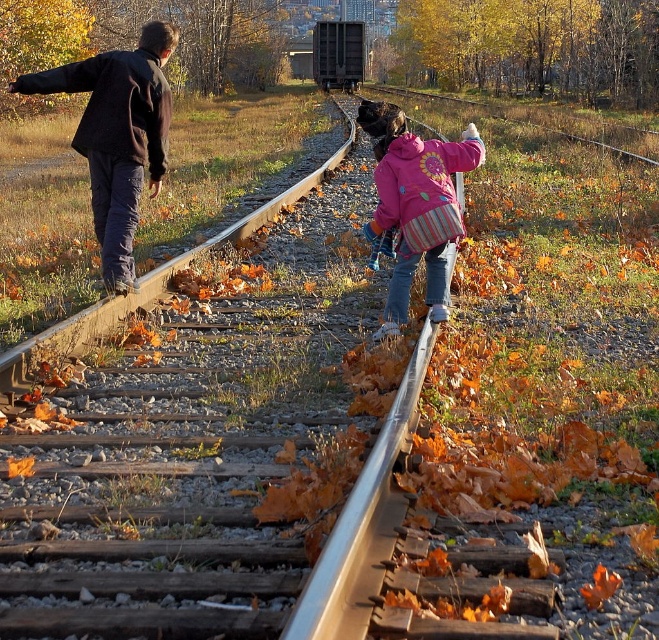
Which is below, dark brown jacket at left or pink fleece jacket at center?

Positioned lower is pink fleece jacket at center.

Who is taller, dark brown jacket at left or pink fleece jacket at center?

Standing taller between the two is dark brown jacket at left.

This screenshot has height=640, width=659. Find the location of `dark brown jacket at left`. dark brown jacket at left is located at coordinates (117, 136).

Locate an element on the screen. dark brown jacket at left is located at coordinates (117, 136).